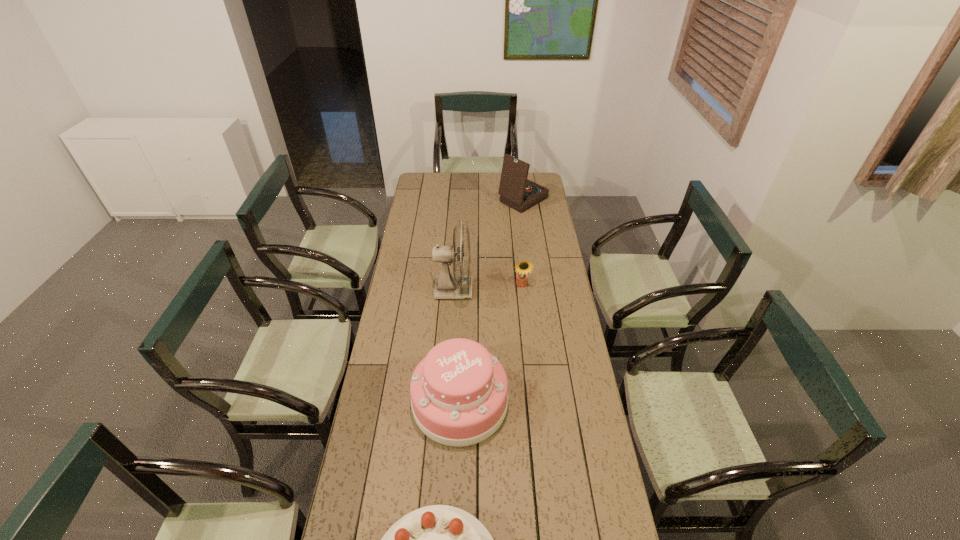
What are the coordinates of `the tallest object` in the screenshot? It's located at (446, 286).

This screenshot has width=960, height=540. I want to click on the farthest object, so click(x=516, y=191).

The image size is (960, 540). Identify the location of phonograph record. (516, 191).

Identify the location of the third shortest object. (459, 392).

Image resolution: width=960 pixels, height=540 pixels. What are the coordinates of `the second nearest object` in the screenshot? It's located at (459, 392).

Identify the location of sunflower. The image size is (960, 540). (523, 267).

The width and height of the screenshot is (960, 540). I want to click on vacant region located on the front-facing side of the fan, so click(554, 290).

Find the location of a particular element. free space located on the front of the phonograph record is located at coordinates pos(530,251).

The width and height of the screenshot is (960, 540). Find the location of `free spot located 0.220m on the back of the fourth farthest object`. free spot located 0.220m on the back of the fourth farthest object is located at coordinates (463, 320).

Where is `vacant position located 0.230m on the face of the sunflower`? This screenshot has width=960, height=540. vacant position located 0.230m on the face of the sunflower is located at coordinates 526,331.